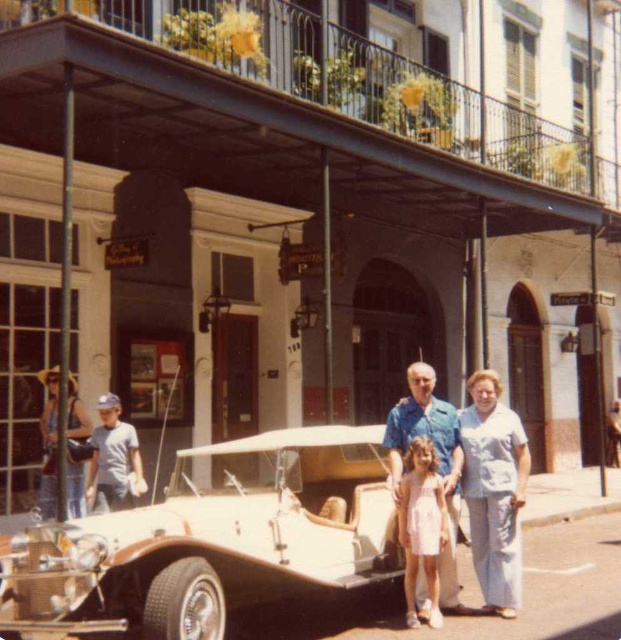
Question: Observing the image, what is the correct spatial positioning of blue cotton shirt at center in reference to denim jacket at left?

Choices:
 (A) below
 (B) above

Answer: (A)

Question: Which object is the closest to the blue cotton shirt at center?

Choices:
 (A) pink satin dress at center
 (B) beige leather car at center
 (C) light blue fabric pants at right
 (D) denim jacket at left

Answer: (A)

Question: Does blue cotton shirt at center lie behind denim jacket at left?

Choices:
 (A) no
 (B) yes

Answer: (A)

Question: Can you confirm if beige leather car at center is wider than denim jacket at left?

Choices:
 (A) no
 (B) yes

Answer: (B)

Question: Which of the following is the farthest from the observer?

Choices:
 (A) denim jacket at left
 (B) blue cotton shirt at center
 (C) beige leather car at center
 (D) pink satin dress at center

Answer: (A)

Question: Which point appears farthest from the camera in this image?

Choices:
 (A) (453, 548)
 (B) (291, 429)

Answer: (B)